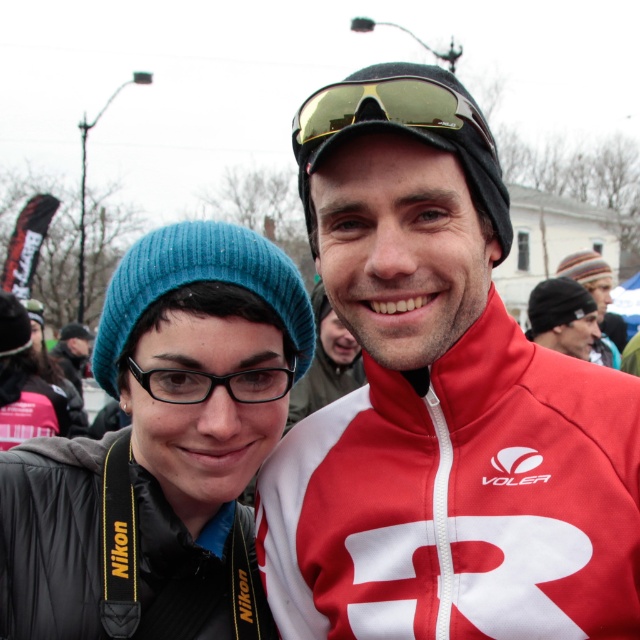
Can you confirm if black nylon jacket at lower left is thinner than striped knit cap at upper right?

Correct, black nylon jacket at lower left's width is less than striped knit cap at upper right's.

Image resolution: width=640 pixels, height=640 pixels. Identify the location of black nylon jacket at lower left. (51, 538).

Is point (51, 445) in front of point (579, 272)?

Yes, point (51, 445) is in front of point (579, 272).

You are a GUI agent. You are given a task and a screenshot of the screen. Output one action in this format:
    pyautogui.click(x=<x>, y=<y>)
    Task: Click on the black nylon jacket at lower left
    
    Given the screenshot: What is the action you would take?
    pyautogui.click(x=51, y=538)

Is matte black beanie at left smaller than black knit cap at upper center?

Correct, matte black beanie at left occupies less space than black knit cap at upper center.

Between matte black beanie at left and black knit cap at upper center, which one appears on the right side from the viewer's perspective?

From the viewer's perspective, black knit cap at upper center appears more on the right side.

Where is `matte black beanie at left`? The width and height of the screenshot is (640, 640). matte black beanie at left is located at coordinates (161, 449).

Locate an element on the screen. The width and height of the screenshot is (640, 640). matte black beanie at left is located at coordinates (161, 449).

Is matte red jacket at center bigger than matte black beanie at left?

Yes.

Does point (397, 170) come closer to viewer compared to point (22, 604)?

Yes, it is in front of point (22, 604).

Find the location of a particular element. matte red jacket at center is located at coordinates (440, 403).